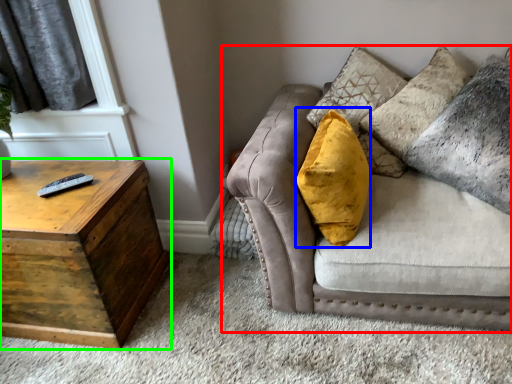
Question: Considering the real-world distances, which object is closest to studio couch (highlighted by a red box)? throw pillow (highlighted by a blue box) or table (highlighted by a green box).

Choices:
 (A) throw pillow
 (B) table

Answer: (A)